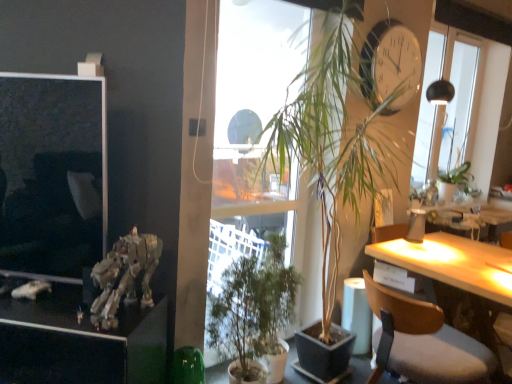
Question: Considering the relative positions of green matte plant at center, which is the first houseplant in top-to-bottom order, and metallic silver robot at left in the image provided, is green matte plant at center, which is the first houseplant in top-to-bottom order, behind metallic silver robot at left?

Choices:
 (A) yes
 (B) no

Answer: (A)

Question: Can you confirm if green matte plant at center, arranged as the second houseplant when ordered from the bottom, is positioned to the left of metallic silver robot at left?

Choices:
 (A) no
 (B) yes

Answer: (A)

Question: Is metallic silver robot at left surrounded by green matte plant at center, arranged as the second houseplant when ordered from the bottom?

Choices:
 (A) yes
 (B) no

Answer: (B)

Question: Can you see green matte plant at center, arranged as the second houseplant when ordered from the bottom, touching metallic silver robot at left?

Choices:
 (A) yes
 (B) no

Answer: (B)

Question: Are green matte plant at center, arranged as the second houseplant when ordered from the bottom, and metallic silver robot at left far apart?

Choices:
 (A) no
 (B) yes

Answer: (B)

Question: Can you confirm if green matte plant at center, arranged as the second houseplant when ordered from the bottom, is thinner than metallic silver robot at left?

Choices:
 (A) yes
 (B) no

Answer: (B)

Question: Considering the relative sizes of metallic gold skeleton at lower left and transparent glass window at upper right in the image provided, is metallic gold skeleton at lower left bigger than transparent glass window at upper right?

Choices:
 (A) no
 (B) yes

Answer: (A)

Question: Considering the relative positions of metallic gold skeleton at lower left and transparent glass window at upper right in the image provided, is metallic gold skeleton at lower left to the right of transparent glass window at upper right from the viewer's perspective?

Choices:
 (A) no
 (B) yes

Answer: (A)

Question: Does metallic gold skeleton at lower left have a greater width compared to transparent glass window at upper right?

Choices:
 (A) no
 (B) yes

Answer: (B)

Question: Is metallic gold skeleton at lower left in contact with transparent glass window at upper right?

Choices:
 (A) yes
 (B) no

Answer: (B)

Question: From a real-world perspective, is metallic gold skeleton at lower left positioned under transparent glass window at upper right based on gravity?

Choices:
 (A) no
 (B) yes

Answer: (B)

Question: From a real-world perspective, is metallic gold skeleton at lower left positioned over transparent glass window at upper right based on gravity?

Choices:
 (A) no
 (B) yes

Answer: (A)

Question: Is metallic gold skeleton at lower left in contact with wooden chair at right?

Choices:
 (A) yes
 (B) no

Answer: (B)